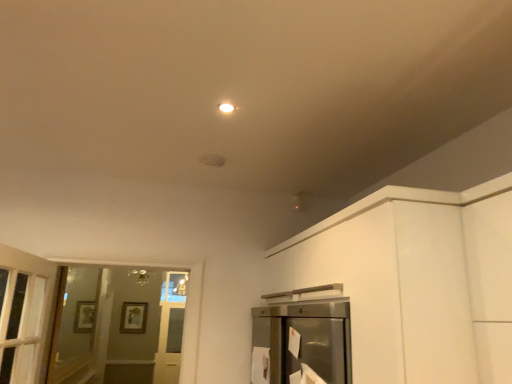
Question: Is white glossy light fixture at upper center smaller than clear glass screen door at left?

Choices:
 (A) yes
 (B) no

Answer: (A)

Question: Is white glossy light fixture at upper center positioned before clear glass screen door at left?

Choices:
 (A) no
 (B) yes

Answer: (B)

Question: From a real-world perspective, is white glossy light fixture at upper center on top of clear glass screen door at left?

Choices:
 (A) no
 (B) yes

Answer: (B)

Question: Is white glossy light fixture at upper center bigger than clear glass screen door at left?

Choices:
 (A) no
 (B) yes

Answer: (A)

Question: Is white glossy light fixture at upper center oriented away from clear glass screen door at left?

Choices:
 (A) no
 (B) yes

Answer: (A)

Question: Can you confirm if white glossy light fixture at upper center is shorter than clear glass screen door at left?

Choices:
 (A) yes
 (B) no

Answer: (A)

Question: Is clear glass screen door at left shorter than white glossy light fixture at upper center?

Choices:
 (A) yes
 (B) no

Answer: (B)

Question: From the image's perspective, does clear glass screen door at left appear lower than white glossy light fixture at upper center?

Choices:
 (A) no
 (B) yes

Answer: (B)

Question: Can you confirm if clear glass screen door at left is positioned to the left of white glossy light fixture at upper center?

Choices:
 (A) no
 (B) yes

Answer: (B)

Question: Is clear glass screen door at left located outside white glossy light fixture at upper center?

Choices:
 (A) no
 (B) yes

Answer: (B)

Question: Considering the relative sizes of clear glass screen door at left and white glossy light fixture at upper center in the image provided, is clear glass screen door at left taller than white glossy light fixture at upper center?

Choices:
 (A) no
 (B) yes

Answer: (B)

Question: Is clear glass screen door at left with white glossy light fixture at upper center?

Choices:
 (A) yes
 (B) no

Answer: (B)

Question: Considering the positions of white glossy light fixture at upper center and clear glass screen door at left in the image, is white glossy light fixture at upper center wider or thinner than clear glass screen door at left?

Choices:
 (A) wide
 (B) thin

Answer: (A)